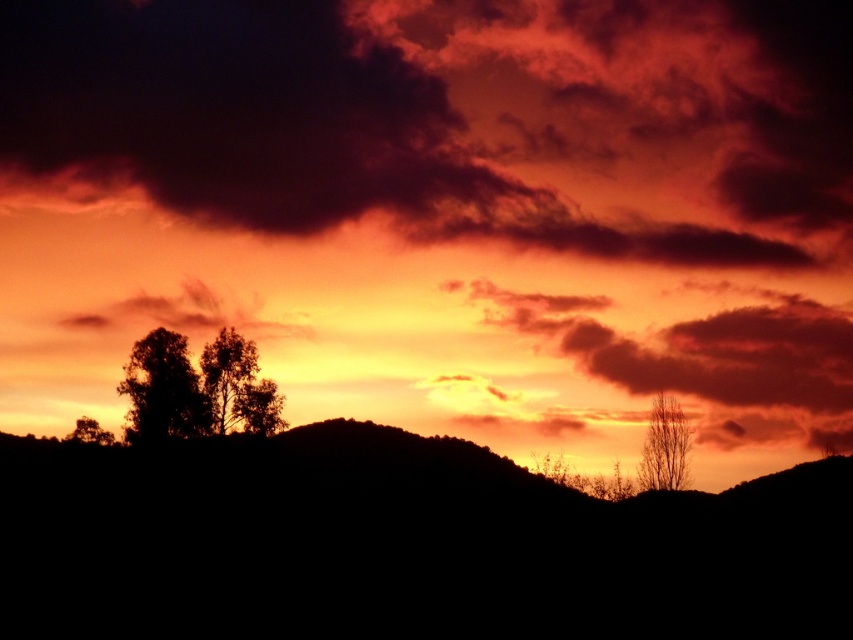
Question: Can you confirm if silhouette hillside at center is wider than silhouette tree at left?

Choices:
 (A) yes
 (B) no

Answer: (A)

Question: Is dark red cloud at upper center wider than silhouette tree at left?

Choices:
 (A) yes
 (B) no

Answer: (A)

Question: Which of the following is the closest to the observer?

Choices:
 (A) (251, 417)
 (B) (184, 388)

Answer: (B)

Question: Does dark green leafy tree at left have a smaller size compared to bare branches at right?

Choices:
 (A) yes
 (B) no

Answer: (A)

Question: Estimate the real-world distances between objects in this image. Which object is closer to the dark red cloud at upper center?

Choices:
 (A) silhouette tree at left
 (B) silhouette hillside at center
 (C) green leafy tree at center
 (D) bare branches at right

Answer: (B)

Question: Which object is farther from the camera taking this photo?

Choices:
 (A) dark red cloud at upper center
 (B) dark green leafy tree at left
 (C) bare branches at right
 (D) silhouette hillside at center

Answer: (C)